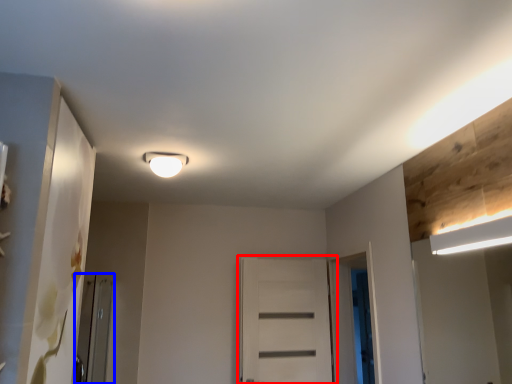
Question: Which object is closer to the camera taking this photo, door (highlighted by a red box) or screen door (highlighted by a blue box)?

Choices:
 (A) door
 (B) screen door

Answer: (B)